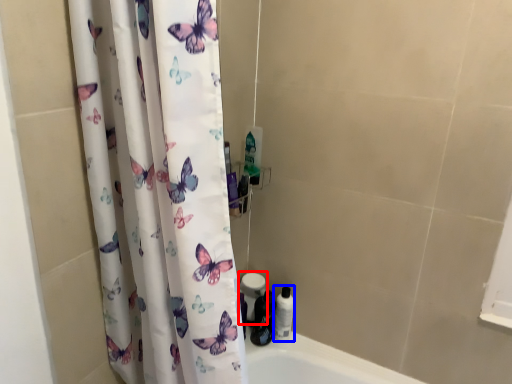
Question: Which point is closer to the camera, toilet paper (highlighted by a red box) or toiletry (highlighted by a blue box)?

Choices:
 (A) toilet paper
 (B) toiletry

Answer: (B)